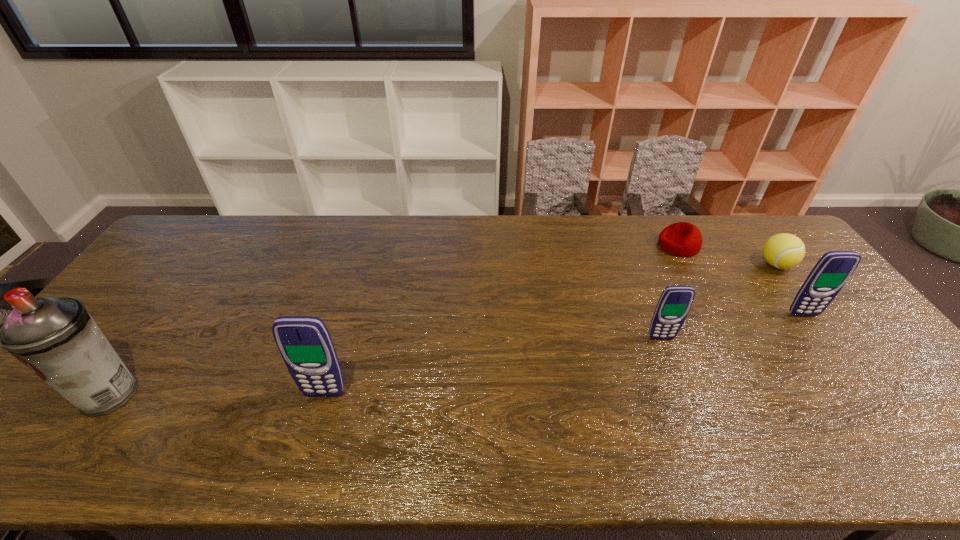
Locate an element on the screen. The height and width of the screenshot is (540, 960). vacant space at the right edge of the desktop is located at coordinates (880, 388).

The height and width of the screenshot is (540, 960). In order to click on vacant point at the far left corner in this screenshot , I will do `click(192, 226)`.

Identify the location of blank space at the far right corner of the desktop. [740, 225].

Find the location of a particular element. The image size is (960, 540). free space that is in between the leftmost cellular telephone and the tallest object is located at coordinates (217, 394).

Find the location of a particular element. The image size is (960, 540). free space that is in between the shortest object and the second object from left to right is located at coordinates click(x=501, y=320).

At what (x,y) coordinates should I click in order to perform the action: click on free space between the leftmost object and the rightmost cellular telephone. Please return your answer as a coordinate pair (x, y). Looking at the image, I should click on (457, 354).

Where is `free point between the shortest object and the second object from left to right`? The height and width of the screenshot is (540, 960). free point between the shortest object and the second object from left to right is located at coordinates (501, 320).

Locate an element on the screen. Image resolution: width=960 pixels, height=540 pixels. free space between the second shortest object and the third nearest object is located at coordinates (718, 301).

Find the location of `vacant space in between the leftmost cellular telephone and the farthest cellular telephone`. vacant space in between the leftmost cellular telephone and the farthest cellular telephone is located at coordinates (564, 354).

Locate an element on the screen. This screenshot has width=960, height=540. empty space between the leftmost object and the second shortest object is located at coordinates click(443, 329).